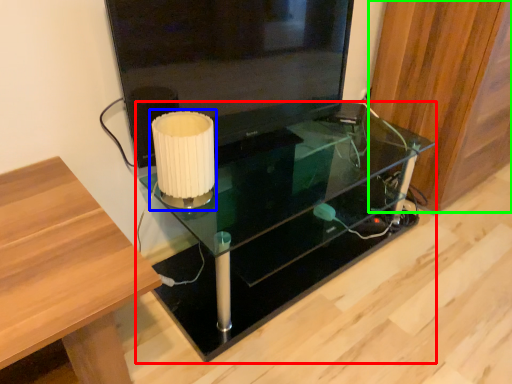
Question: Which is nearer to the table (highlighted by a red box)? table lamp (highlighted by a blue box) or wood (highlighted by a green box).

Choices:
 (A) table lamp
 (B) wood

Answer: (B)